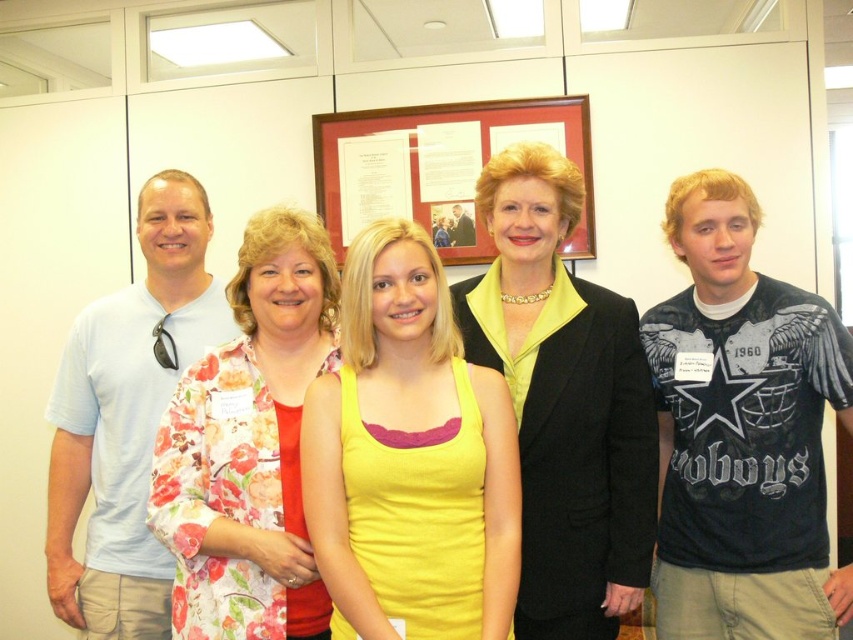
Based on the scene description, which clothing item is closer to the camera between the yellow fabric tank top at center and the black textured blazer at center?

The yellow fabric tank top at center is in front of the black textured blazer at center, so it is closer to the camera.

You are standing in the office scene and want to place a small plant between the two points labeled as point (555, 118) and point (471, 140). Which point should the plant be closer to in order to be positioned between them?

The plant should be closer to point (471, 140) because point (555, 118) is closer to the viewer than point (471, 140). To place the plant between them, it needs to be nearer to the point that is farther away.